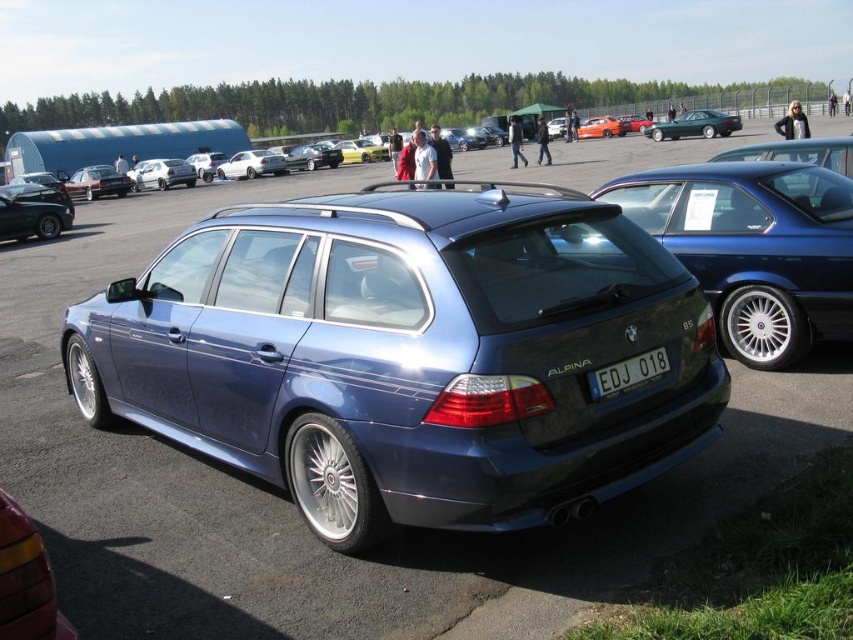
Question: From the image, what is the correct spatial relationship of metallic green sedan at center in relation to metallic silver sedan at center?

Choices:
 (A) above
 (B) below

Answer: (A)

Question: Where is metallic green sedan at center located in relation to metallic silver sedan at center in the image?

Choices:
 (A) below
 (B) above

Answer: (B)

Question: Which object appears closest to the camera in this image?

Choices:
 (A) satin blue wagon at center
 (B) metallic green sedan at center

Answer: (A)

Question: Is metallic green sedan at center positioned before metallic silver sedan at center?

Choices:
 (A) no
 (B) yes

Answer: (A)

Question: Among these objects, which one is nearest to the camera?

Choices:
 (A) metallic green sedan at center
 (B) white plastic license plate at center

Answer: (B)

Question: Which point is closer to the camera taking this photo?

Choices:
 (A) (190, 182)
 (B) (766, 305)
 (C) (666, 356)

Answer: (C)